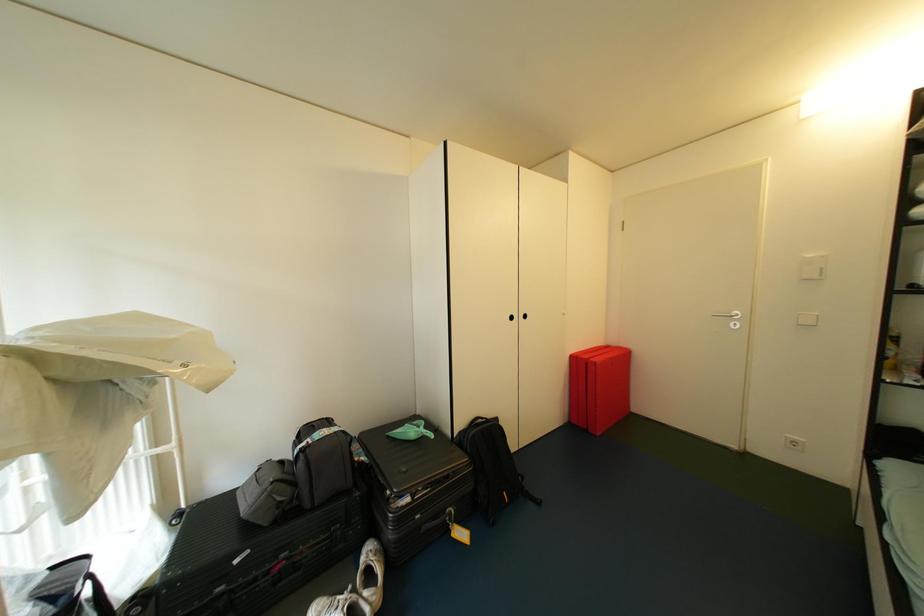
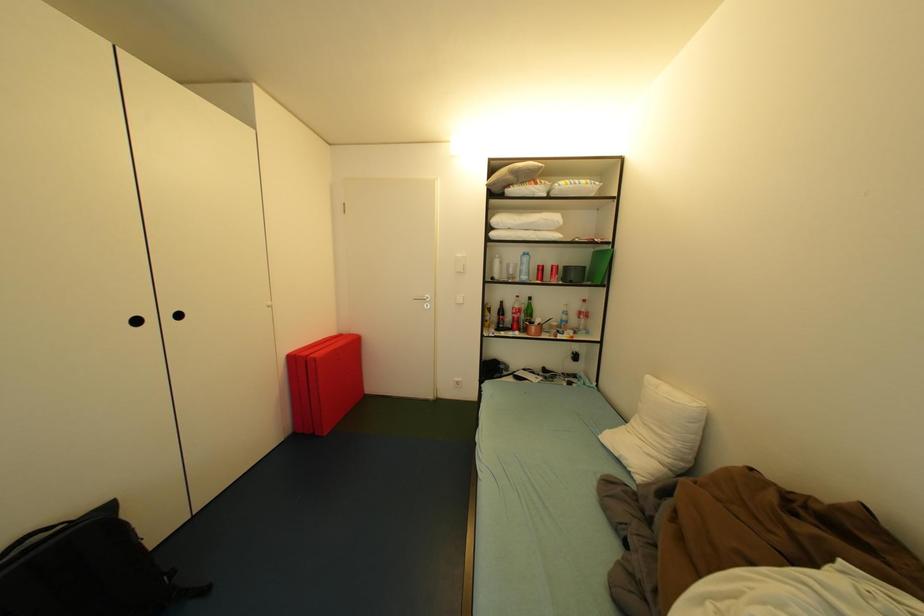
Question: The camera is either moving clockwise (left) or counter-clockwise (right) around the object. The first image is from the beginning of the video and the second image is from the end. Is the camera moving left or right when shooting the video?

Choices:
 (A) Left
 (B) Right

Answer: (A)